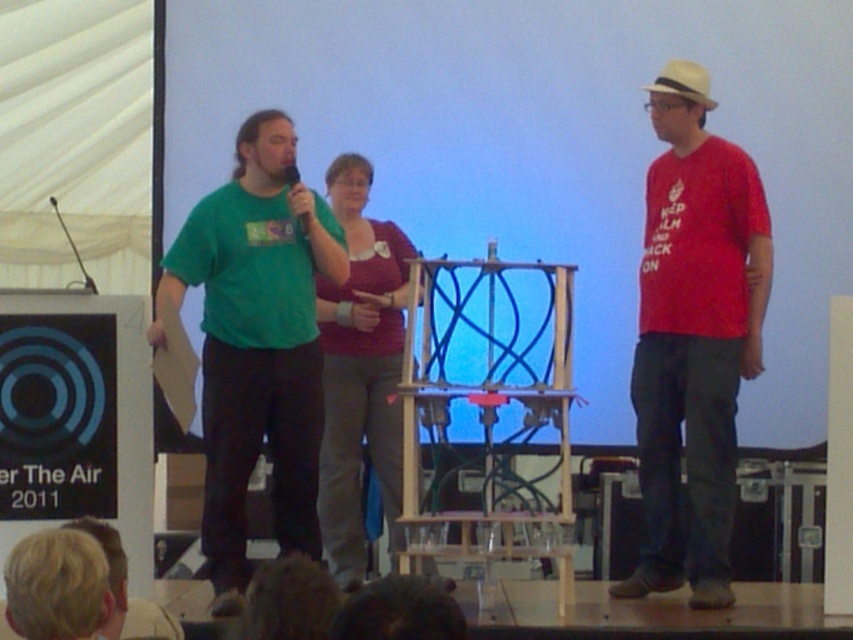
You are a photographer standing at the front of the stage. You want to take a photo of both the point at (683, 205) and the point at (238, 276). Which point will appear closer to the camera in the photo?

Point (238, 276) will appear closer to the camera in the photo because it is physically closer to the camera than point (683, 205), which is further away.